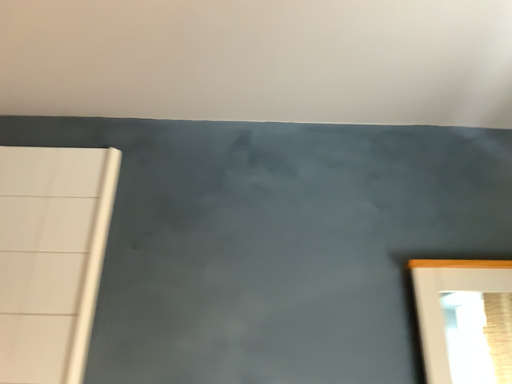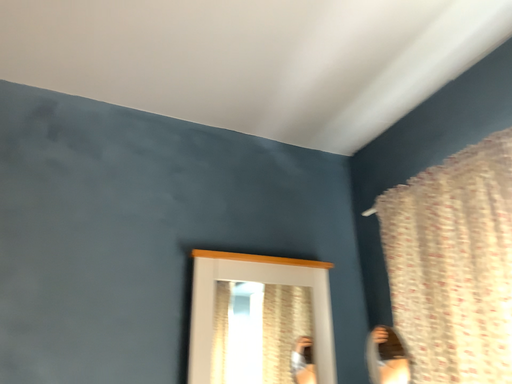
Question: How did the camera likely rotate when shooting the video?

Choices:
 (A) rotated left
 (B) rotated right

Answer: (B)